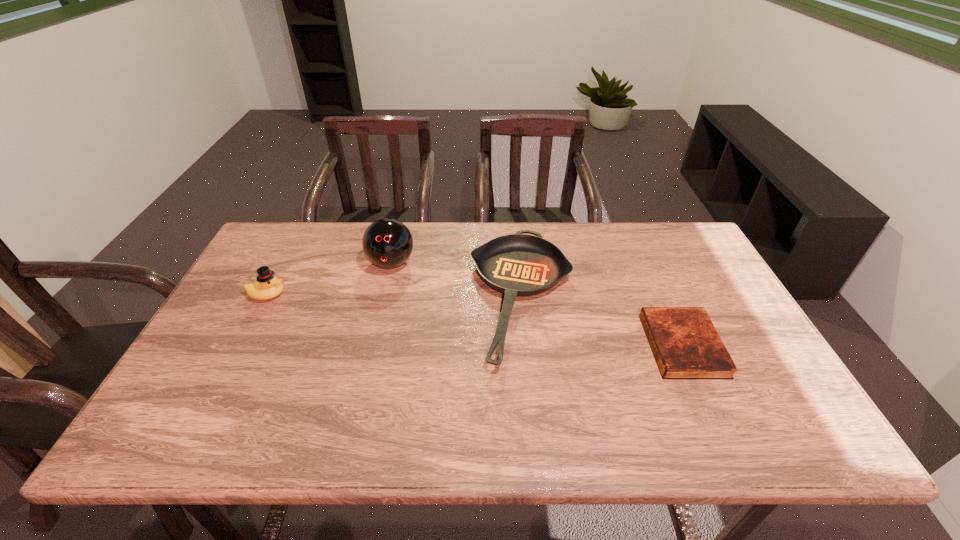
Find the location of a particular element. vacant area in the image that satisfies the following two spatial constraints: 1. on the front-facing side of the duck; 2. on the right side of the second object from right to left is located at coordinates (266, 297).